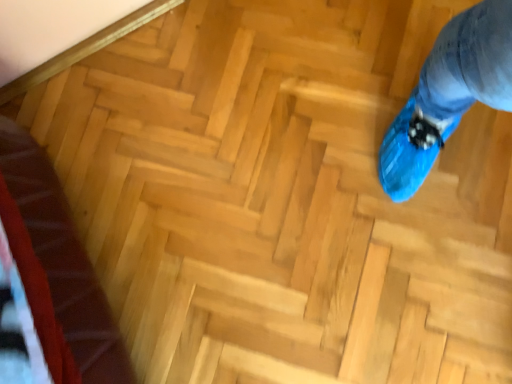
This screenshot has height=384, width=512. Describe the element at coordinates (62, 259) in the screenshot. I see `velvet red blanket at lower left` at that location.

I want to click on velvet red blanket at lower left, so click(x=62, y=259).

Where is `velvet red blanket at lower left`? The height and width of the screenshot is (384, 512). velvet red blanket at lower left is located at coordinates (62, 259).